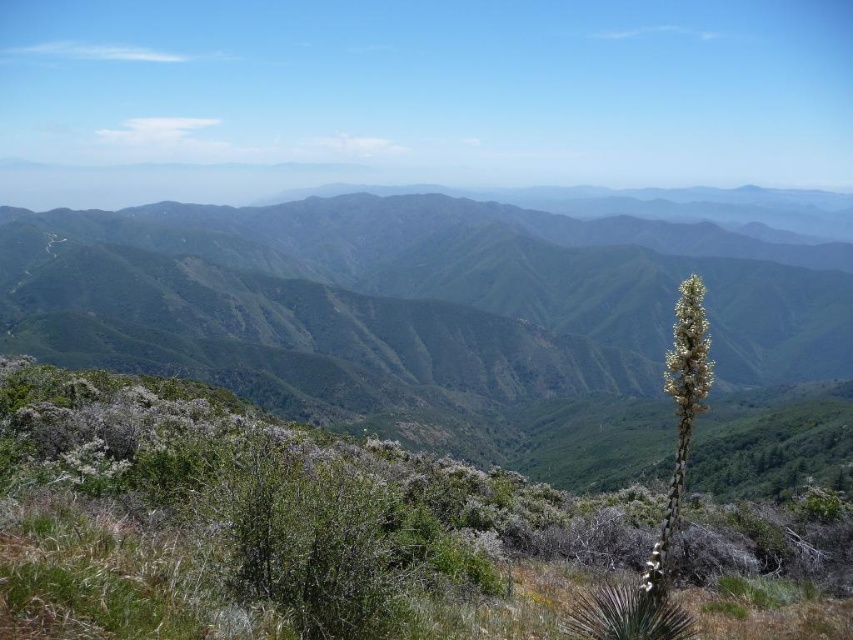
Question: Can you confirm if green textured mountain range at center is bigger than green leafy plant at center?

Choices:
 (A) no
 (B) yes

Answer: (B)

Question: Does green textured mountain range at center have a lesser width compared to green leafy plant at center?

Choices:
 (A) no
 (B) yes

Answer: (A)

Question: Can you confirm if green textured mountain range at center is bigger than green leafy plant at center?

Choices:
 (A) no
 (B) yes

Answer: (B)

Question: Which point is closer to the camera?

Choices:
 (A) (210, 410)
 (B) (114, 292)

Answer: (A)

Question: Which point is farther to the camera?

Choices:
 (A) 518,221
 (B) 538,618

Answer: (A)

Question: Which point is farther to the camera?

Choices:
 (A) (76, 426)
 (B) (412, 404)

Answer: (B)